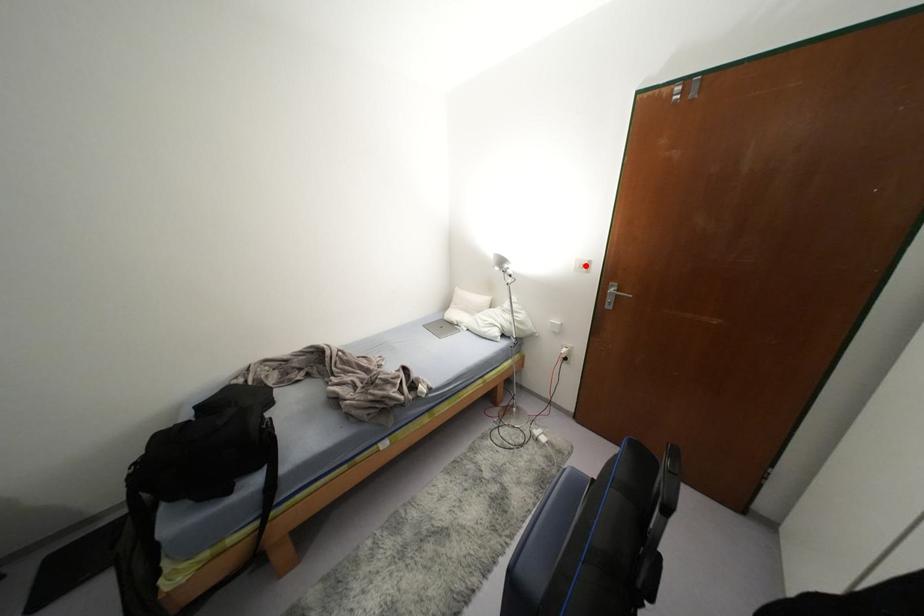
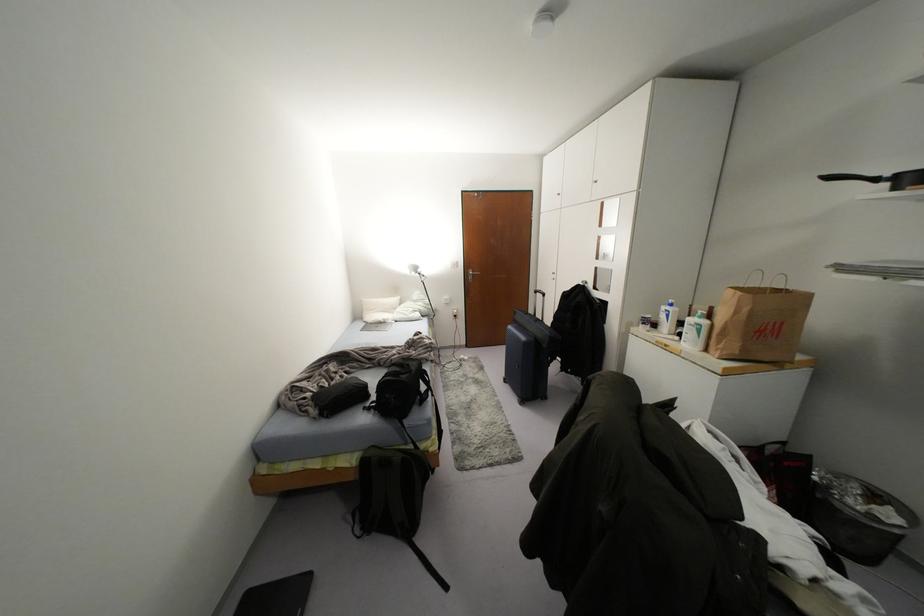
Locate, in the second image, the point that corresponds to the highlighted location in the first image.

(456, 264)